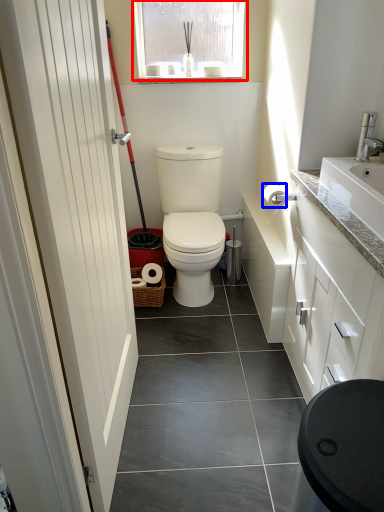
Question: Which point is further to the camera, window (highlighted by a red box) or toilet paper (highlighted by a blue box)?

Choices:
 (A) window
 (B) toilet paper

Answer: (A)